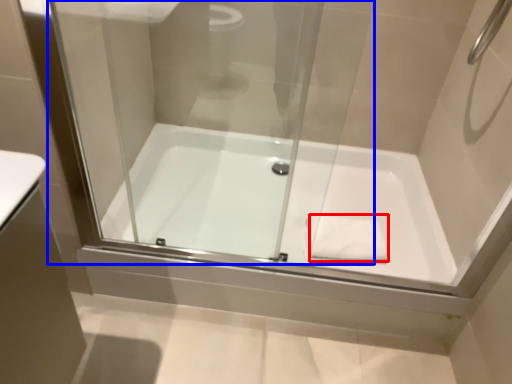
Question: Which object is closer to the camera taking this photo, hand towel (highlighted by a red box) or glass door (highlighted by a blue box)?

Choices:
 (A) hand towel
 (B) glass door

Answer: (B)